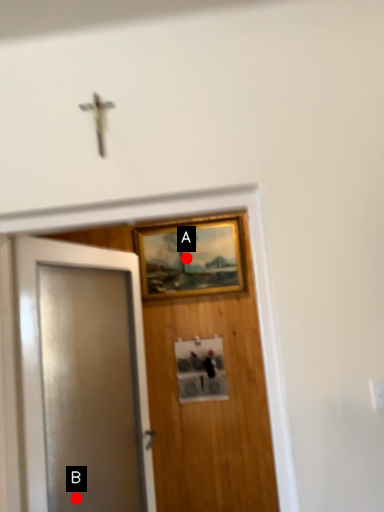
Question: Two points are circled on the image, labeled by A and B beside each circle. Which point is closer to the camera taking this photo?

Choices:
 (A) A is closer
 (B) B is closer

Answer: (B)